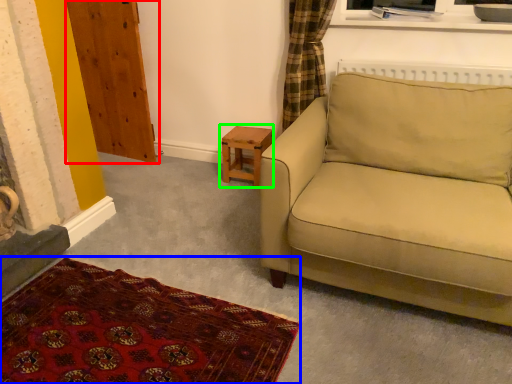
Question: Considering the real-world distances, which object is farthest from armoire (highlighted by a red box)? plain (highlighted by a blue box) or table (highlighted by a green box)?

Choices:
 (A) plain
 (B) table

Answer: (A)